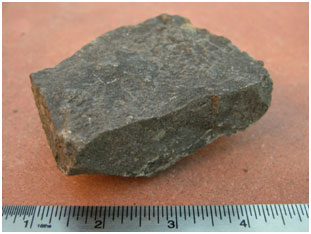
At what (x,y) coordinates should I click in order to perform the action: click on ruler. Please return your answer as a coordinate pair (x, y). The height and width of the screenshot is (234, 311). Looking at the image, I should click on (4, 225), (304, 228).